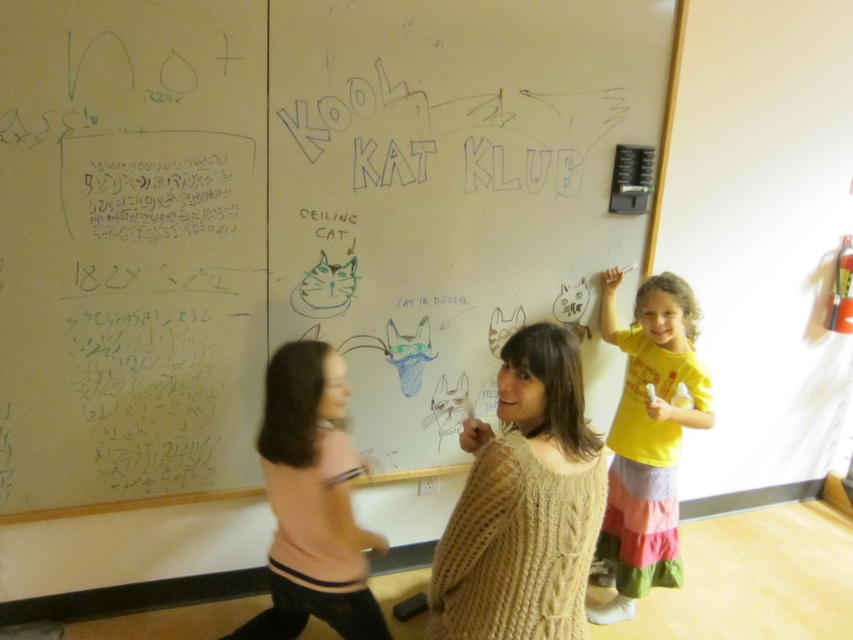
Question: Based on their relative distances, which object is nearer to the pink fabric shirt at lower left?

Choices:
 (A) whiteboard at center
 (B) yellow cotton shirt at upper right

Answer: (A)

Question: Based on their relative distances, which object is nearer to the whiteboard at center?

Choices:
 (A) yellow cotton shirt at upper right
 (B) pink fabric shirt at lower left
 (C) cable-knit sweater at center

Answer: (B)

Question: Does whiteboard at center come behind yellow cotton shirt at upper right?

Choices:
 (A) yes
 (B) no

Answer: (B)

Question: Is cable-knit sweater at center behind yellow cotton shirt at upper right?

Choices:
 (A) yes
 (B) no

Answer: (B)

Question: Does cable-knit sweater at center come behind pink fabric shirt at lower left?

Choices:
 (A) yes
 (B) no

Answer: (B)

Question: Which of the following is the closest to the observer?

Choices:
 (A) whiteboard at center
 (B) yellow cotton shirt at upper right

Answer: (A)